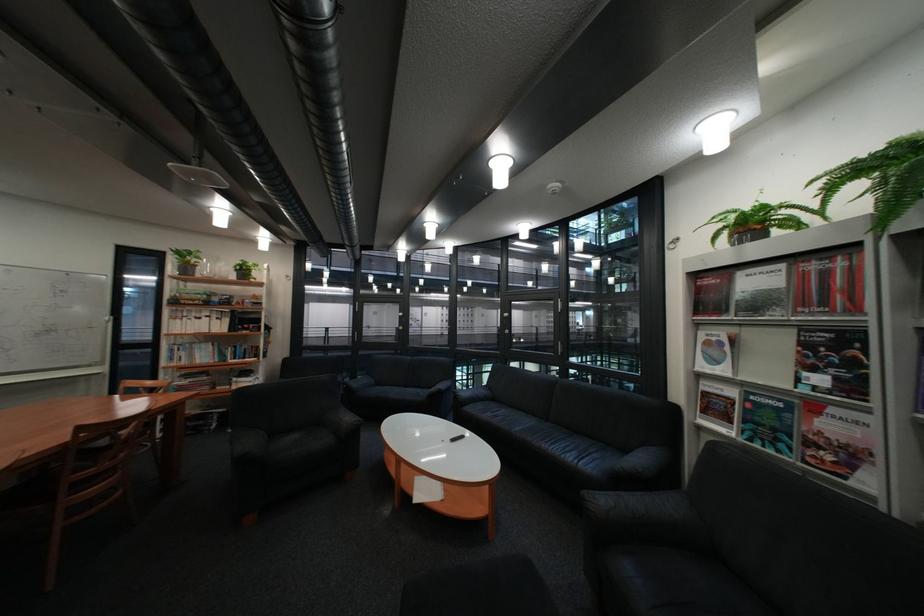
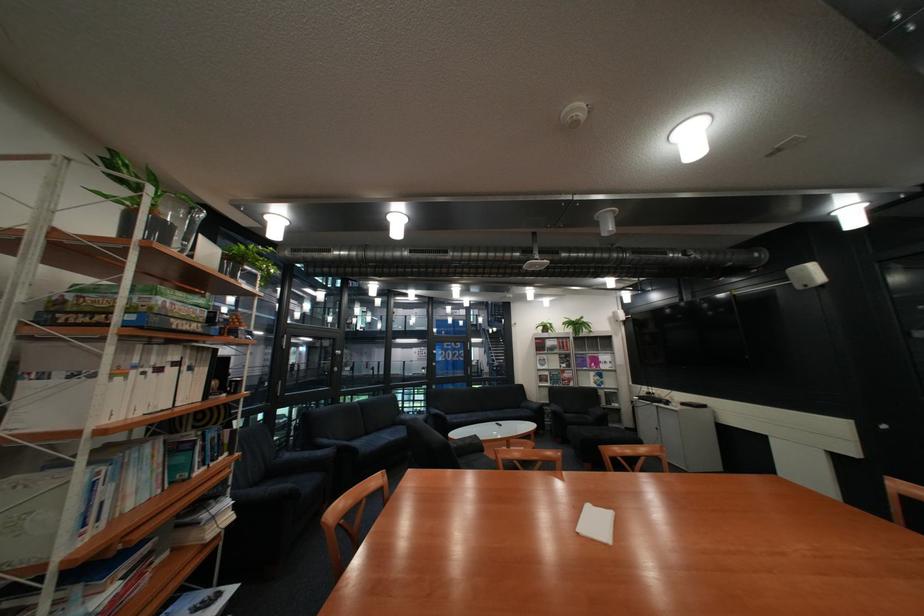
Find the pixel in the second image that matches point (622, 330) in the first image.

(344, 365)